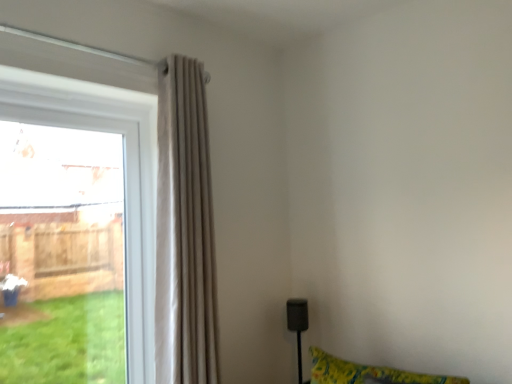
Question: Would you say beige fabric curtain at left is a long distance from clear glass window at left?

Choices:
 (A) no
 (B) yes

Answer: (A)

Question: From a real-world perspective, is beige fabric curtain at left beneath clear glass window at left?

Choices:
 (A) yes
 (B) no

Answer: (B)

Question: Can clear glass window at left be found inside beige fabric curtain at left?

Choices:
 (A) yes
 (B) no

Answer: (B)

Question: Does beige fabric curtain at left appear on the left side of clear glass window at left?

Choices:
 (A) yes
 (B) no

Answer: (B)

Question: Could you tell me if beige fabric curtain at left is facing clear glass window at left?

Choices:
 (A) no
 (B) yes

Answer: (A)

Question: Is beige fabric curtain at left to the right of clear glass window at left from the viewer's perspective?

Choices:
 (A) no
 (B) yes

Answer: (B)

Question: Is the depth of clear glass window at left greater than that of beige fabric curtain at left?

Choices:
 (A) no
 (B) yes

Answer: (B)

Question: Is clear glass window at left closer to the viewer compared to beige fabric curtain at left?

Choices:
 (A) yes
 (B) no

Answer: (B)

Question: Is clear glass window at left looking in the opposite direction of beige fabric curtain at left?

Choices:
 (A) yes
 (B) no

Answer: (B)

Question: Can you confirm if clear glass window at left is bigger than beige fabric curtain at left?

Choices:
 (A) no
 (B) yes

Answer: (A)

Question: Could you tell me if clear glass window at left is turned towards beige fabric curtain at left?

Choices:
 (A) no
 (B) yes

Answer: (B)

Question: Considering the relative sizes of clear glass window at left and beige fabric curtain at left in the image provided, is clear glass window at left taller than beige fabric curtain at left?

Choices:
 (A) yes
 (B) no

Answer: (B)

Question: From a real-world perspective, relative to beige fabric curtain at left, is clear glass window at left vertically above or below?

Choices:
 (A) below
 (B) above

Answer: (A)